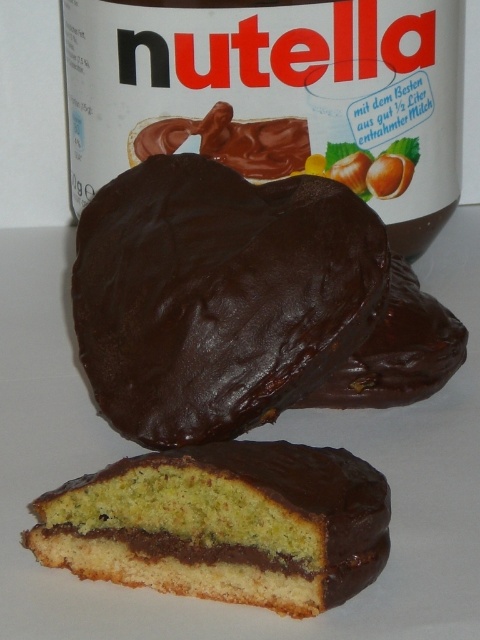
Question: Does shiny dark chocolate cake at center appear on the right side of chocolate-coated cake at center?

Choices:
 (A) yes
 (B) no

Answer: (B)

Question: Considering the relative positions of shiny dark chocolate cake at center and chocolate-coated cake at center in the image provided, where is shiny dark chocolate cake at center located with respect to chocolate-coated cake at center?

Choices:
 (A) below
 (B) above

Answer: (B)

Question: Which point is closer to the camera taking this photo?

Choices:
 (A) (43, 557)
 (B) (273, 410)

Answer: (A)

Question: Can you confirm if shiny dark chocolate cake at center is smaller than chocolate-coated cake at center?

Choices:
 (A) yes
 (B) no

Answer: (B)

Question: Which point is closer to the camera taking this photo?

Choices:
 (A) (135, 298)
 (B) (254, 520)

Answer: (B)

Question: Which point appears farthest from the camera in this image?

Choices:
 (A) pos(159,195)
 (B) pos(34,502)

Answer: (A)